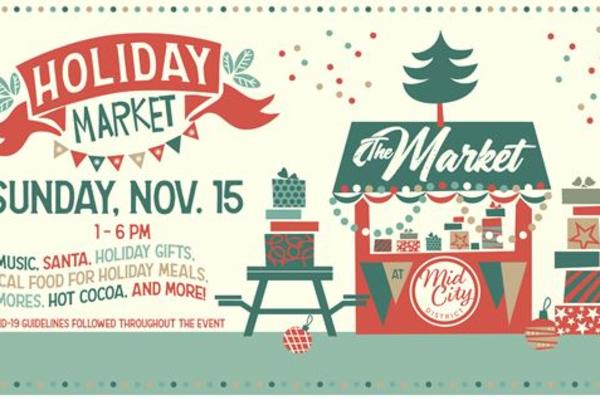
Detect presence of where star would go on christmas tree in the image and mark them. Your answer should be formatted as a list of tuples, i.e. [(x1, y1), (x2, y2), ...], where each tuple contains the x and y coordinates of a point satisfying the conditions above.

[(440, 32)]